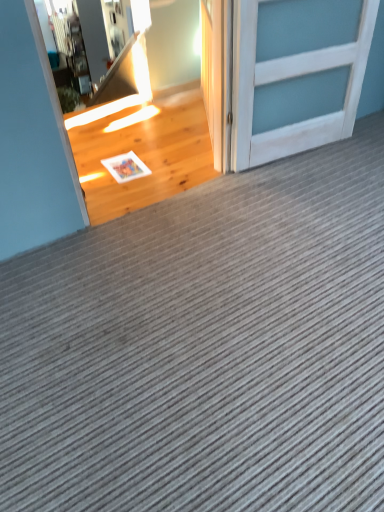
Question: Does white wood door at upper right, placed as the 1th door when sorted from left to right, lie behind white wood door at upper right, the first door when ordered from right to left?

Choices:
 (A) no
 (B) yes

Answer: (B)

Question: Can you confirm if white wood door at upper right, placed as the 1th door when sorted from left to right, is positioned to the right of white wood door at upper right, the first door when ordered from right to left?

Choices:
 (A) no
 (B) yes

Answer: (A)

Question: Does white wood door at upper right, placed as the 2th door when sorted from right to left, come in front of white wood door at upper right, the first door when ordered from right to left?

Choices:
 (A) no
 (B) yes

Answer: (A)

Question: From a real-world perspective, is white wood door at upper right, placed as the 2th door when sorted from right to left, positioned over white wood door at upper right, the first door when ordered from right to left, based on gravity?

Choices:
 (A) no
 (B) yes

Answer: (A)

Question: Can you confirm if white wood door at upper right, placed as the 1th door when sorted from left to right, is positioned to the left of white wood door at upper right, the second door when ordered from left to right?

Choices:
 (A) no
 (B) yes

Answer: (B)

Question: Is white wood door at upper right, the first door when ordered from right to left, a part of white wood door at upper right, placed as the 2th door when sorted from right to left?

Choices:
 (A) yes
 (B) no

Answer: (B)

Question: From the image's perspective, is white wood door at upper right, the first door when ordered from right to left, beneath white wood door at upper right, placed as the 2th door when sorted from right to left?

Choices:
 (A) no
 (B) yes

Answer: (B)

Question: From a real-world perspective, is white wood door at upper right, the second door when ordered from left to right, physically below white wood door at upper right, placed as the 2th door when sorted from right to left?

Choices:
 (A) no
 (B) yes

Answer: (A)

Question: Is white wood door at upper right, the first door when ordered from right to left, aimed at white wood door at upper right, placed as the 1th door when sorted from left to right?

Choices:
 (A) no
 (B) yes

Answer: (A)

Question: Is white wood door at upper right, the second door when ordered from left to right, outside white wood door at upper right, placed as the 1th door when sorted from left to right?

Choices:
 (A) yes
 (B) no

Answer: (A)

Question: Does white wood door at upper right, the second door when ordered from left to right, have a smaller size compared to white wood door at upper right, placed as the 2th door when sorted from right to left?

Choices:
 (A) no
 (B) yes

Answer: (A)

Question: From a real-world perspective, is white wood door at upper right, the first door when ordered from right to left, over white wood door at upper right, placed as the 1th door when sorted from left to right?

Choices:
 (A) yes
 (B) no

Answer: (A)

Question: From a real-world perspective, is white wood door at upper right, the first door when ordered from right to left, above or below white wood door at upper right, placed as the 2th door when sorted from right to left?

Choices:
 (A) below
 (B) above

Answer: (B)